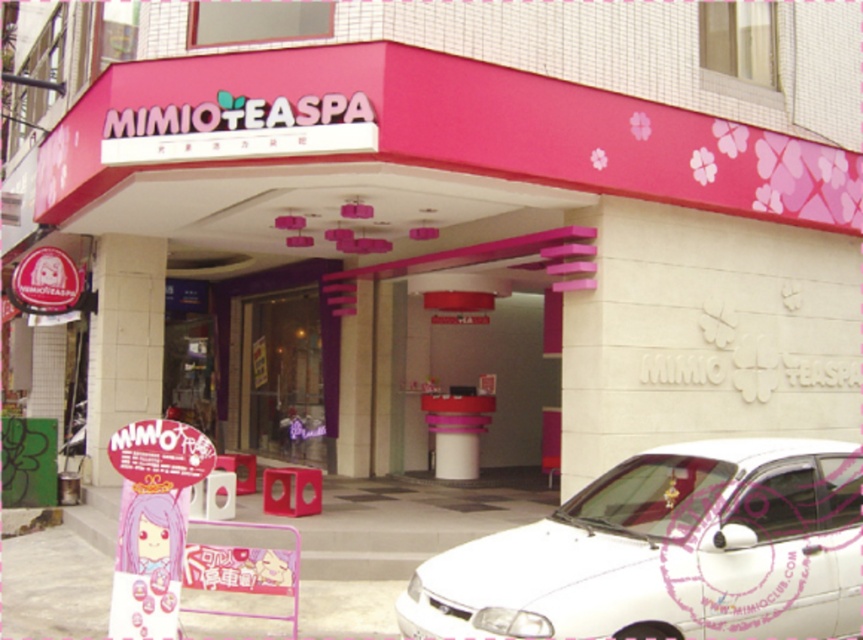
Question: Which point is closer to the camera?

Choices:
 (A) (272, 428)
 (B) (111, 317)

Answer: (B)

Question: Can you confirm if white glossy car at lower right is positioned to the right of transparent glass door at center?

Choices:
 (A) no
 (B) yes

Answer: (B)

Question: Which of the following is the farthest from the observer?

Choices:
 (A) (757, 570)
 (B) (268, 365)
 (C) (150, 385)

Answer: (B)

Question: Can you confirm if white glossy car at lower right is positioned above transparent glass door at center?

Choices:
 (A) yes
 (B) no

Answer: (B)

Question: Which point is farther from the camera taking this photo?

Choices:
 (A) (139, 392)
 (B) (247, 346)
 (C) (628, 493)

Answer: (B)

Question: In this image, where is white glossy car at lower right located relative to transparent glass door at center?

Choices:
 (A) right
 (B) left

Answer: (A)